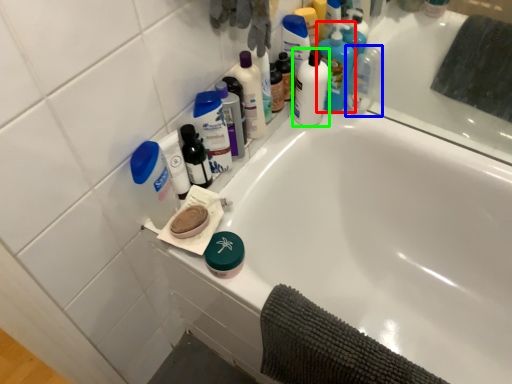
Question: Based on their relative distances, which object is farther from cleaning product (highlighted by a red box)? Choose from mouthwash (highlighted by a blue box) and mouthwash (highlighted by a green box).

Choices:
 (A) mouthwash
 (B) mouthwash

Answer: (B)